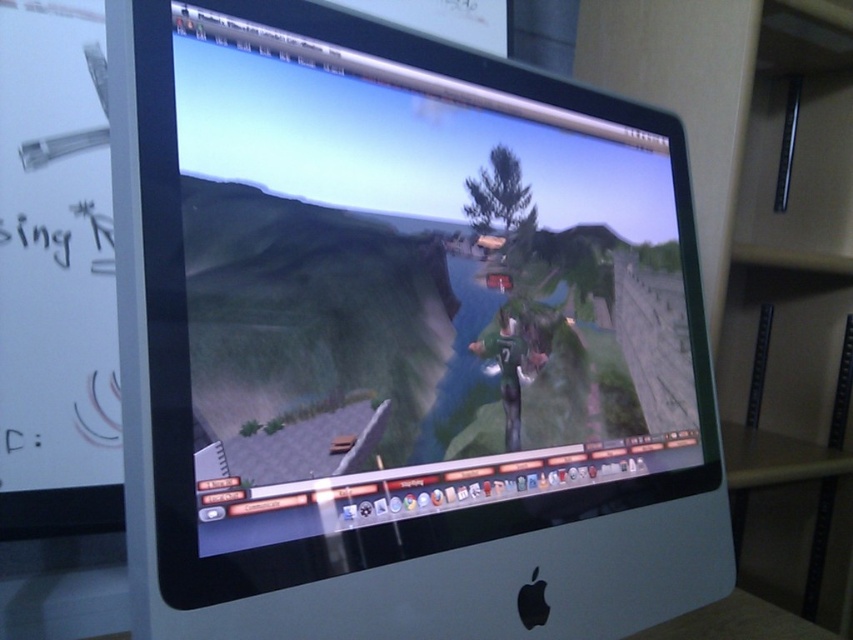
Question: Among these points, which one is farthest from the camera?

Choices:
 (A) (381, 481)
 (B) (809, 68)

Answer: (B)

Question: Is satin silver monitor at center thinner than beige wood bookshelf at right?

Choices:
 (A) yes
 (B) no

Answer: (B)

Question: Can you confirm if satin silver monitor at center is positioned below beige wood bookshelf at right?

Choices:
 (A) yes
 (B) no

Answer: (B)

Question: Which point appears farthest from the camera in this image?

Choices:
 (A) pos(689,3)
 (B) pos(473,372)

Answer: (A)

Question: Can you confirm if satin silver monitor at center is positioned above beige wood bookshelf at right?

Choices:
 (A) yes
 (B) no

Answer: (A)